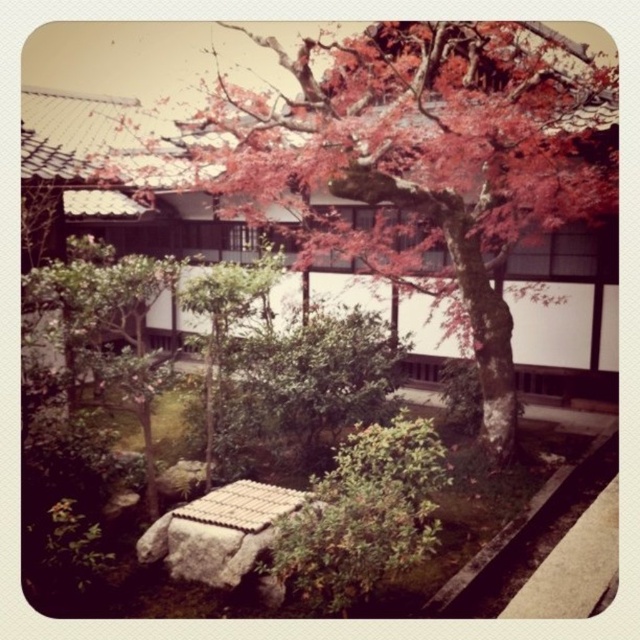
Question: Which of the following is the closest to the observer?

Choices:
 (A) smooth bark tree at center
 (B) green leafy bush at center

Answer: (A)

Question: Is smooth bark tree at center below green leafy bush at center?

Choices:
 (A) yes
 (B) no

Answer: (B)

Question: Can you confirm if green leafy bush at lower left is positioned below green leafy bush at center?

Choices:
 (A) yes
 (B) no

Answer: (A)

Question: Considering the real-world distances, which object is closest to the smooth bark tree at center?

Choices:
 (A) green leafy bush at center
 (B) green leafy bush at lower left

Answer: (A)

Question: Is smooth bark tree at center thinner than green leafy bush at lower left?

Choices:
 (A) yes
 (B) no

Answer: (A)

Question: Which point is farther to the camera?

Choices:
 (A) smooth bark tree at center
 (B) green leafy bush at lower left
 (C) green leafy bush at center

Answer: (B)